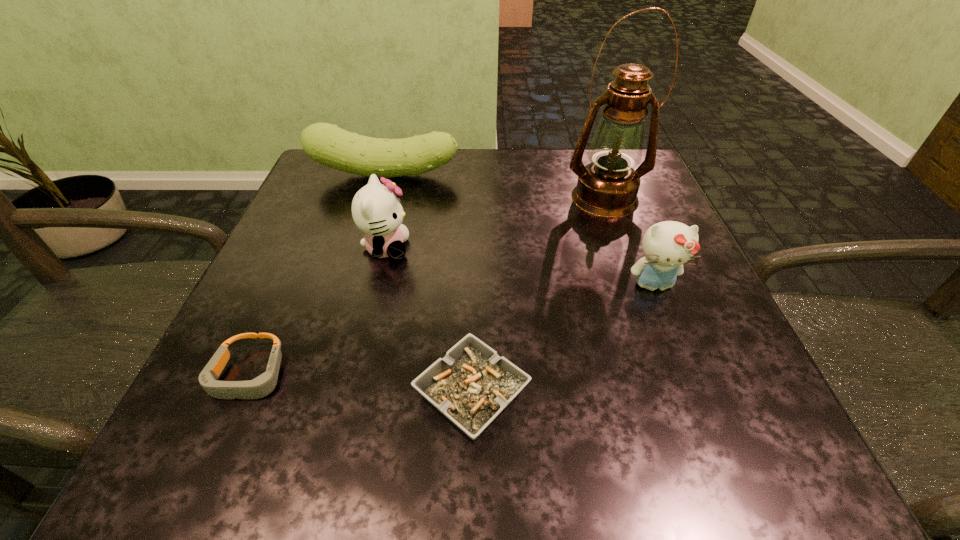
Where is `oil lamp`? Image resolution: width=960 pixels, height=540 pixels. oil lamp is located at coordinates (607, 187).

The width and height of the screenshot is (960, 540). What are the coordinates of `the left kitten` in the screenshot? It's located at (376, 211).

The width and height of the screenshot is (960, 540). I want to click on the right kitten, so click(x=667, y=245).

Find the location of a particular element. cucumber is located at coordinates (327, 144).

This screenshot has width=960, height=540. What are the coordinates of `goggles` in the screenshot? It's located at (261, 386).

You are a GUI agent. You are given a task and a screenshot of the screen. Output one action in this format:
    pyautogui.click(x=<x>, y=<y>)
    Task: Click on the ashtray
    This screenshot has height=540, width=960.
    Given the screenshot: What is the action you would take?
    pyautogui.click(x=472, y=384)

I want to click on blank space located 0.060m on the back of the oil lamp, so click(593, 167).

Find the location of `vacant space located 0.120m on the front-facing side of the left kitten`. vacant space located 0.120m on the front-facing side of the left kitten is located at coordinates (473, 248).

At what (x,y) coordinates should I click in order to perform the action: click on vacant space positioned 0.220m on the front-facing side of the right kitten. Please return your answer as a coordinate pair (x, y). Looking at the image, I should click on [708, 424].

Locate an element on the screen. The width and height of the screenshot is (960, 540). vacant space positioned on the front of the cucumber is located at coordinates (355, 281).